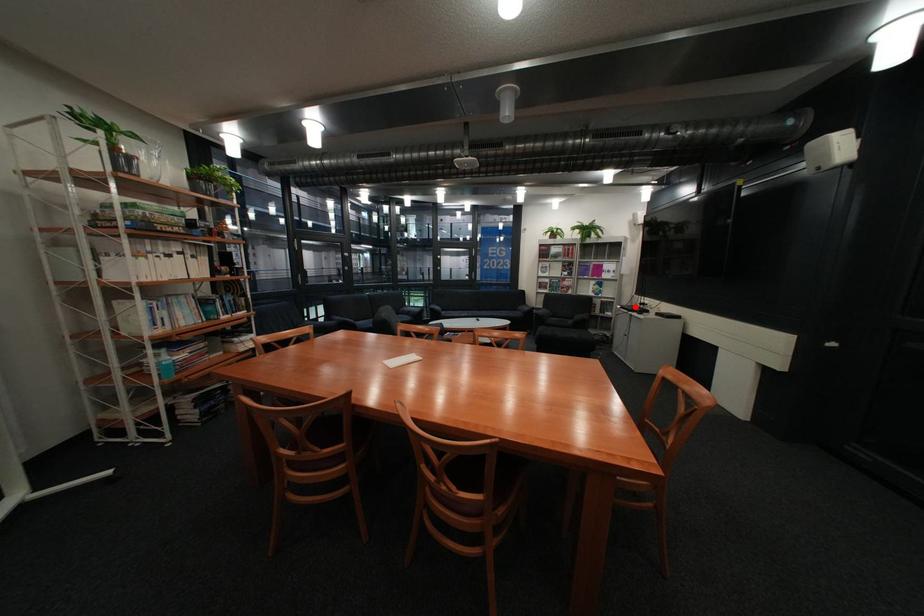
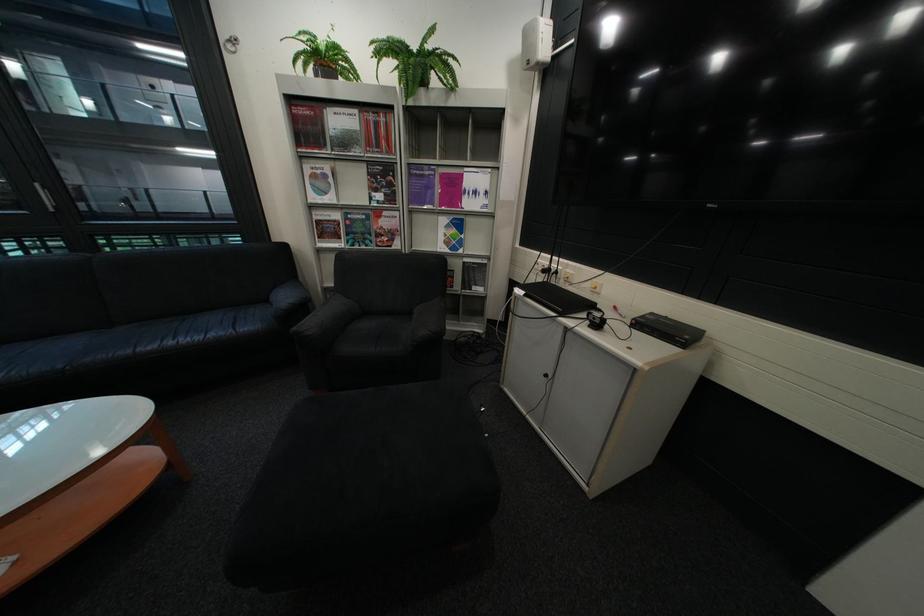
Question: I am providing you with two images of the same scene from different viewpoints. In image1, a red point is highlighted. Considering the same 3D point in image2, which of the following is correct?

Choices:
 (A) It is closer
 (B) It is farther

Answer: (B)